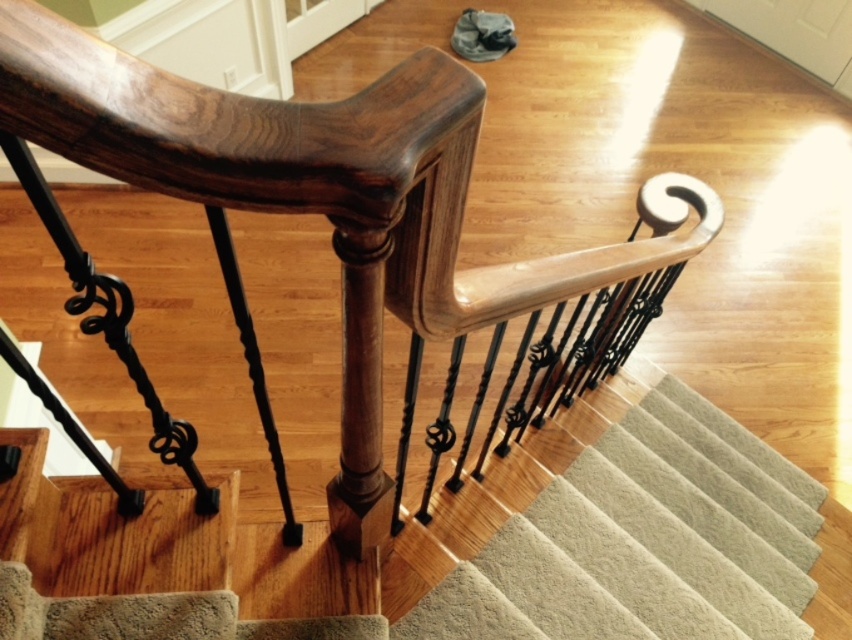
In the scene shown: Is glossy wood handrail at upper center positioned in front of carpeted stairs at center?

Yes, glossy wood handrail at upper center is closer to the viewer.

Which is above, glossy wood handrail at upper center or carpeted stairs at center?

glossy wood handrail at upper center

Between point (246, 168) and point (588, 609), which one is positioned behind?

The point (588, 609) is behind.

Where is `glossy wood handrail at upper center`? glossy wood handrail at upper center is located at coordinates (354, 232).